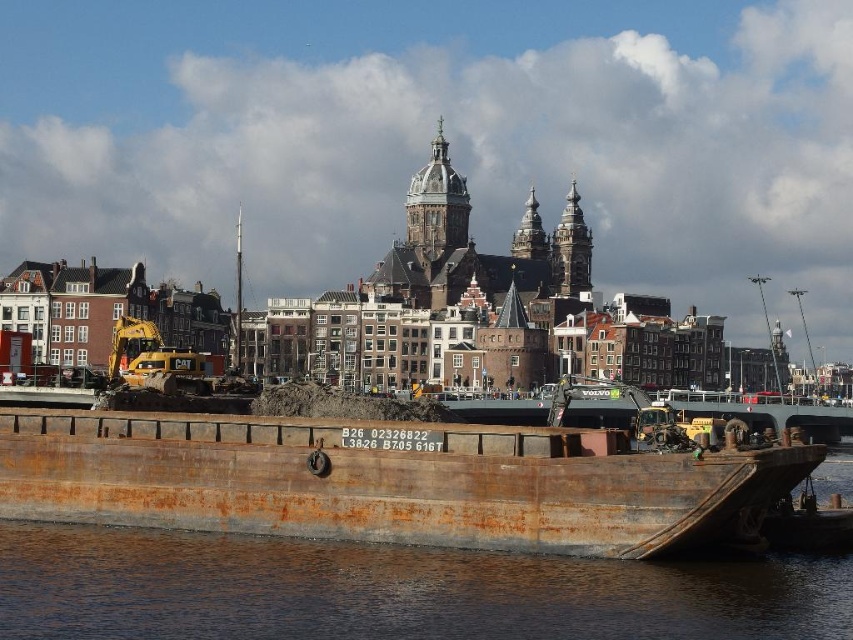
You are standing on the dock and see the rusty metal barge at lower center and the rusty metallic water at lower center. Which object is positioned to the right side?

The rusty metal barge at lower center is to the right of the rusty metallic water at lower center.

You are a crane operator trying to lift a heavy container from the rusty metal barge at lower center. You notice the rusty metallic water at lower center nearby. Which object should you avoid hitting with the crane to prevent damage?

You should avoid hitting the rusty metal barge at lower center because it is larger in size than the rusty metallic water at lower center, making it more likely to cause damage if struck.